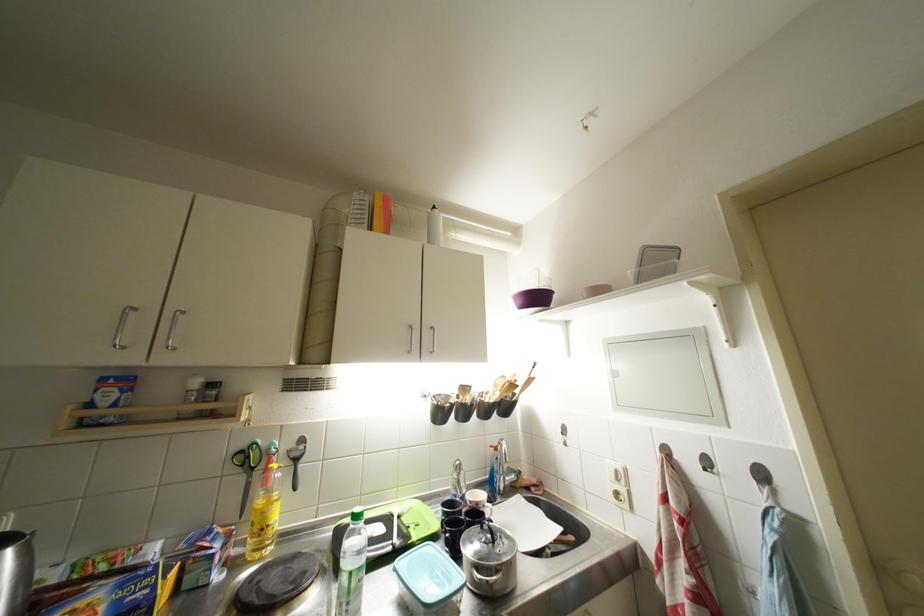
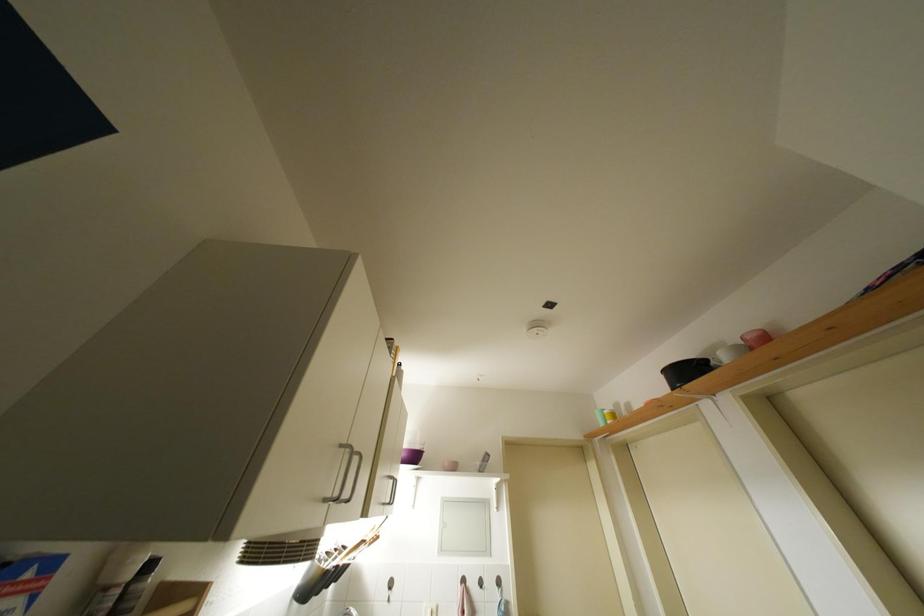
The point at (625, 408) is marked in the first image. Where is the corresponding point in the second image?

(447, 554)